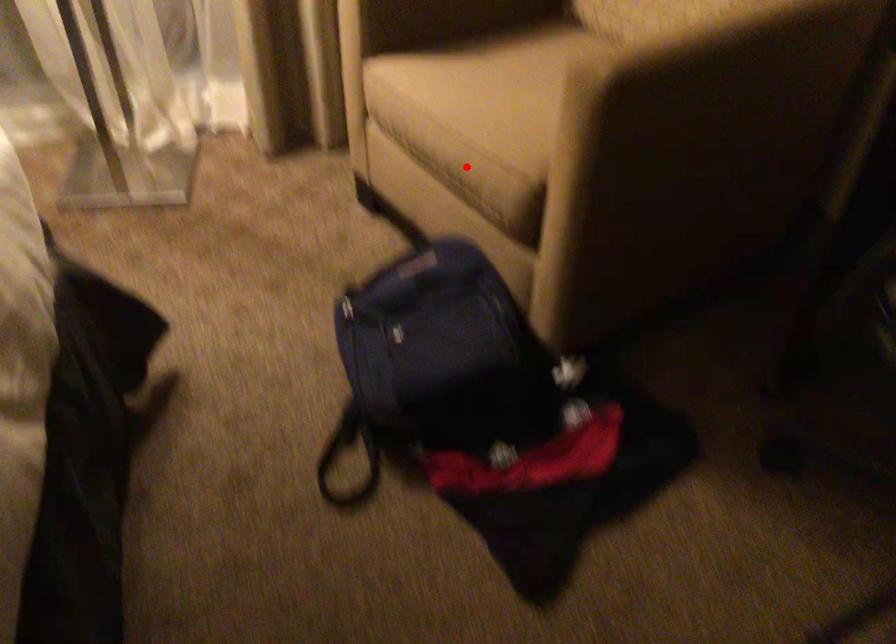
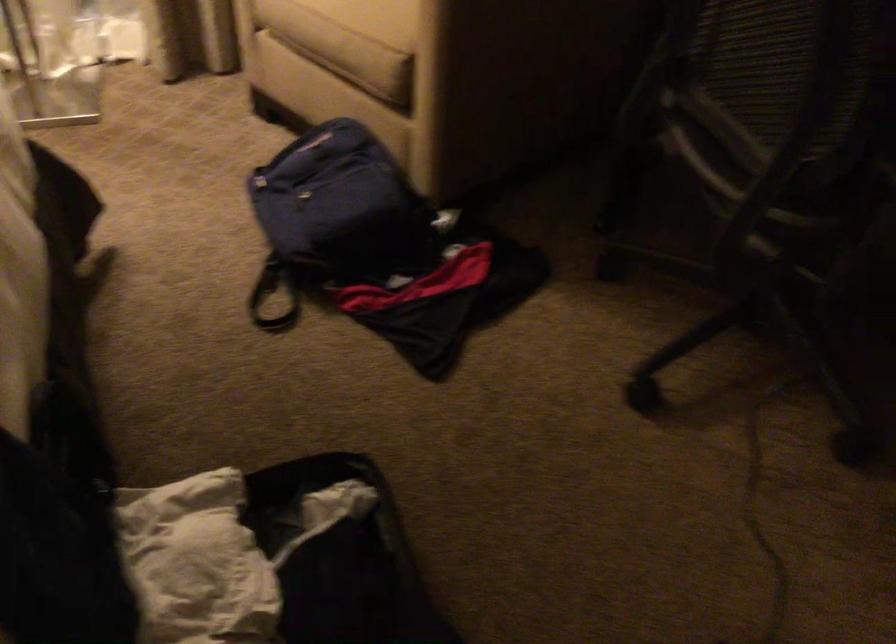
Locate, in the second image, the point that corresponds to the highlighted location in the first image.

(347, 53)